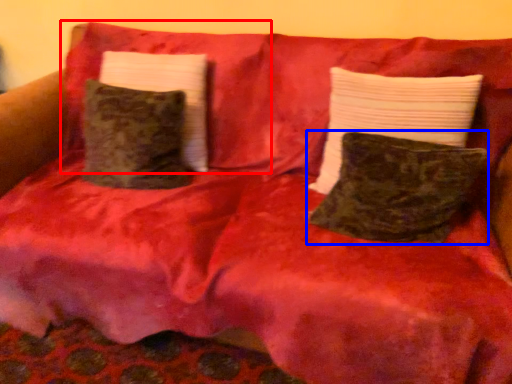
Question: Which of the following is the farthest to the observer, pillow (highlighted by a red box) or pillow (highlighted by a blue box)?

Choices:
 (A) pillow
 (B) pillow

Answer: (A)